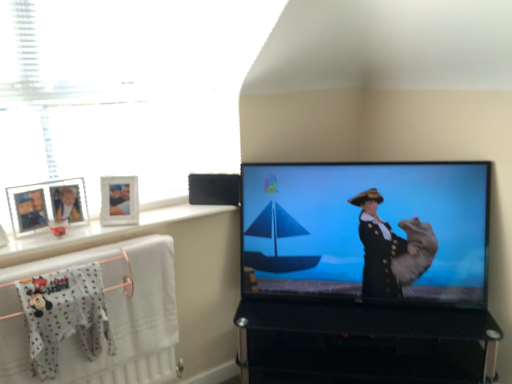
This screenshot has height=384, width=512. I want to click on vacant point above white textured towel at lower left (from a real-world perspective), so click(72, 256).